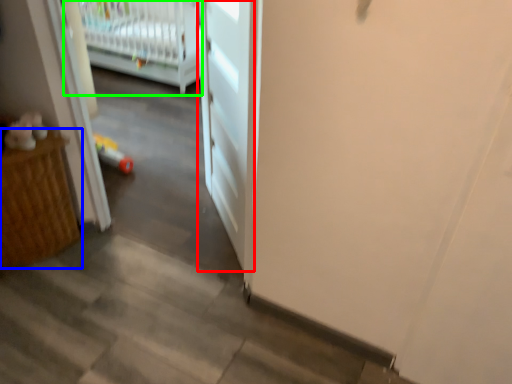
Question: Which object is the closest to the door (highlighted by a red box)? Choose among these: furniture (highlighted by a blue box) or infant bed (highlighted by a green box).

Choices:
 (A) furniture
 (B) infant bed

Answer: (A)